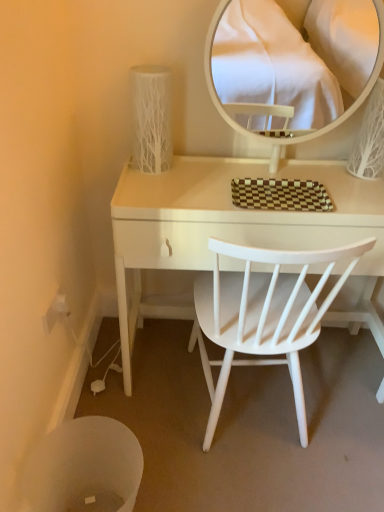
Locate an element on the screen. vacant space to the right of white textured vase at upper left is located at coordinates (210, 170).